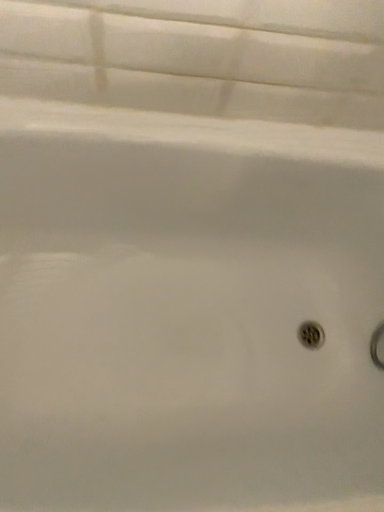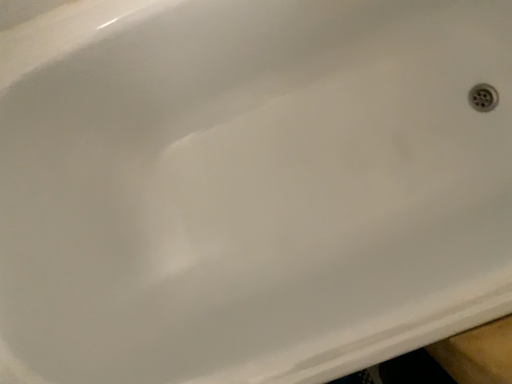
Question: How did the camera likely rotate when shooting the video?

Choices:
 (A) rotated upward
 (B) rotated downward

Answer: (B)